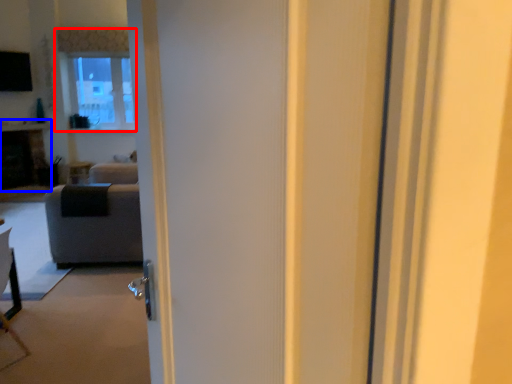
Question: Which object appears closest to the camera in this image, window (highlighted by a red box) or fireplace (highlighted by a blue box)?

Choices:
 (A) window
 (B) fireplace

Answer: (B)